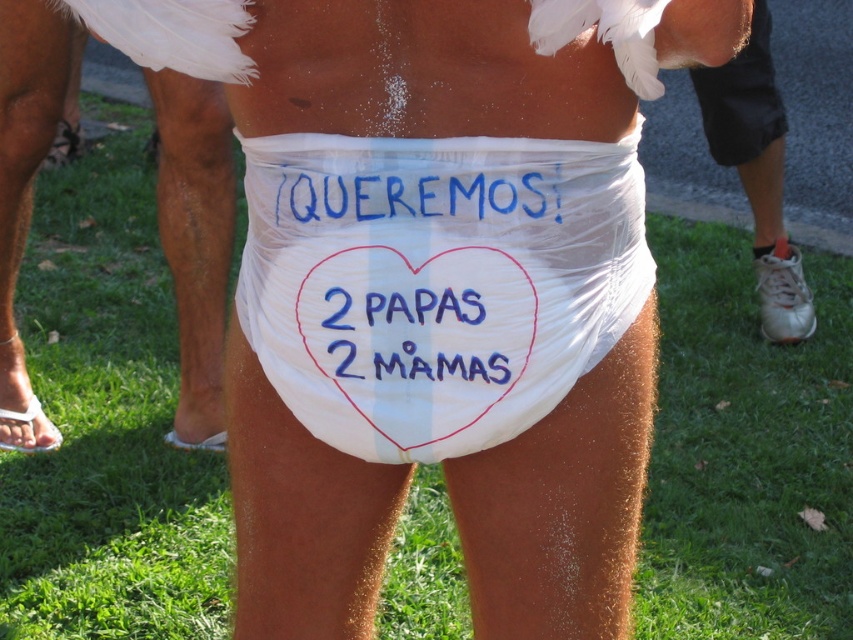
Question: Which point is farther from the camera taking this photo?

Choices:
 (A) pos(172,112)
 (B) pos(383,141)

Answer: (A)

Question: Which object appears farthest from the camera in this image?

Choices:
 (A) white plastic diaper at center
 (B) blue ink text at center
 (C) white cloth diaper at lower center
 (D) white leather shoe at right

Answer: (D)

Question: Is white plastic diaper at center smaller than white cloth diaper at lower center?

Choices:
 (A) yes
 (B) no

Answer: (A)

Question: Is white plastic diaper at center smaller than white leather shoe at right?

Choices:
 (A) no
 (B) yes

Answer: (B)

Question: Can you confirm if white plastic diaper at center is positioned below white cloth diaper at lower center?

Choices:
 (A) no
 (B) yes

Answer: (B)

Question: Which of the following is the closest to the observer?

Choices:
 (A) blue ink text at center
 (B) blue fabric sign at upper center
 (C) white leather shoe at right

Answer: (B)